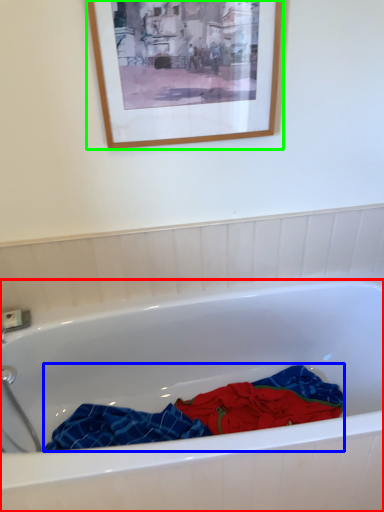
Question: Based on their relative distances, which object is farther from bathtub (highlighted by a red box)? Choose from material (highlighted by a blue box) and picture frame (highlighted by a green box).

Choices:
 (A) material
 (B) picture frame

Answer: (B)